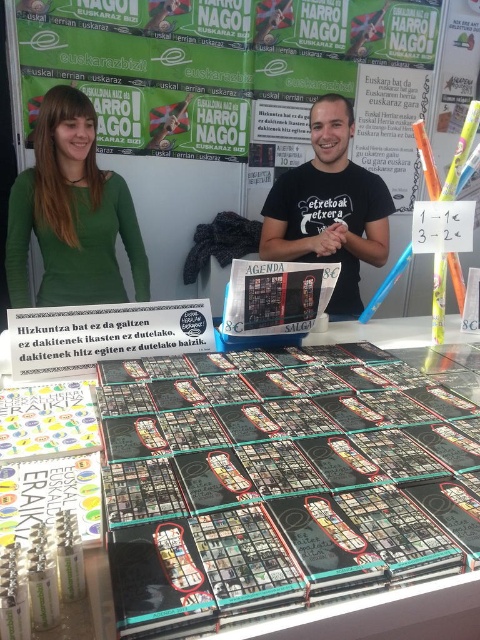
Who is more distant from viewer, [276,509] or [25,266]?

Positioned behind is point [25,266].

In the scene shown: Does black glossy book at center appear under green matte shirt at upper left?

Indeed, black glossy book at center is positioned under green matte shirt at upper left.

Is point (213, 412) farther from viewer compared to point (60, 269)?

No, it is in front of (60, 269).

I want to click on black glossy book at center, so click(x=288, y=492).

Which is more to the right, black glossy book at center or black matte t-shirt at center?

From the viewer's perspective, black matte t-shirt at center appears more on the right side.

The image size is (480, 640). What do you see at coordinates (288, 492) in the screenshot?
I see `black glossy book at center` at bounding box center [288, 492].

Where is `black glossy book at center`? The height and width of the screenshot is (640, 480). black glossy book at center is located at coordinates (288, 492).

Does green matte shirt at upper left come in front of black matte t-shirt at center?

No, green matte shirt at upper left is behind black matte t-shirt at center.

Which is more to the left, green matte shirt at upper left or black matte t-shirt at center?

green matte shirt at upper left is more to the left.

Does point (47, 246) lie behind point (337, 118)?

Yes, point (47, 246) is behind point (337, 118).

This screenshot has height=640, width=480. In order to click on green matte shirt at upper left in this screenshot , I will do `click(72, 212)`.